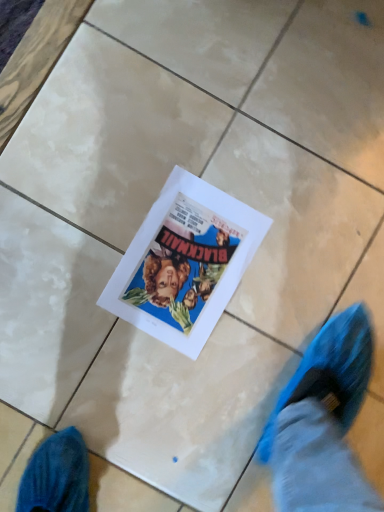
Locate an element on the screen. The width and height of the screenshot is (384, 512). vacant space behind white paper at center is located at coordinates (265, 160).